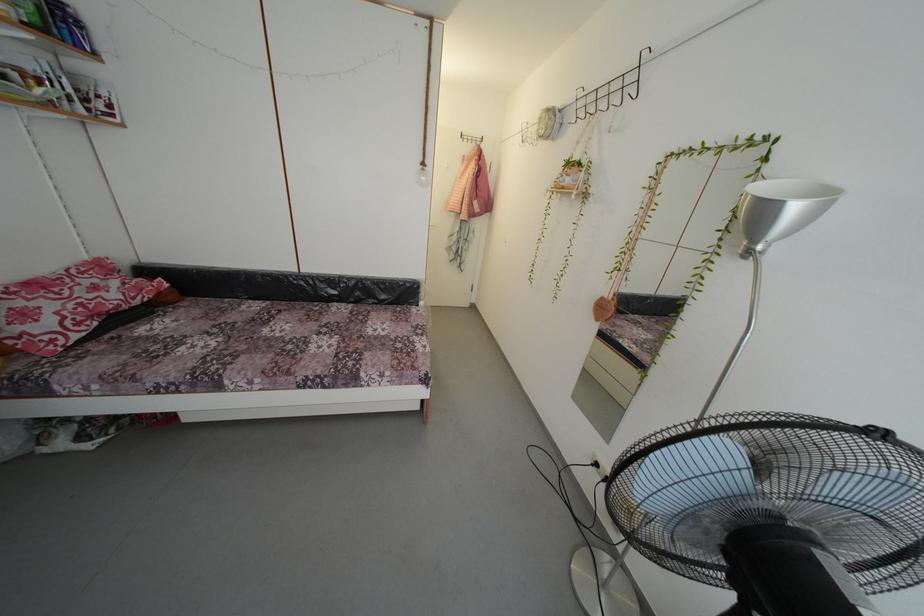
Where would you unlatch the fan cage clip? Please return your answer as a coordinate pair (x, y).

(747, 514)